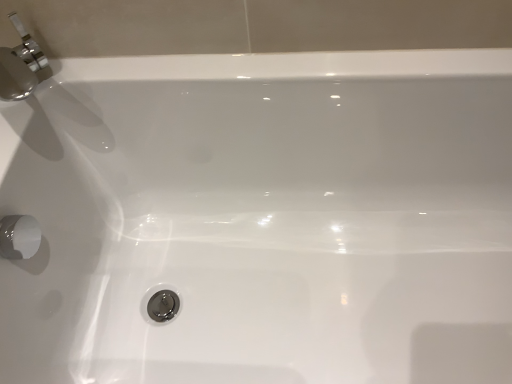
Locate an element on the screen. The image size is (512, 384). polished chrome faucet at upper left is located at coordinates (20, 65).

Measure the distance between point (11, 57) and camera.

The depth of point (11, 57) is 29.84 inches.

What do you see at coordinates (20, 65) in the screenshot? I see `polished chrome faucet at upper left` at bounding box center [20, 65].

Locate an element on the screen. polished chrome faucet at upper left is located at coordinates (20, 65).